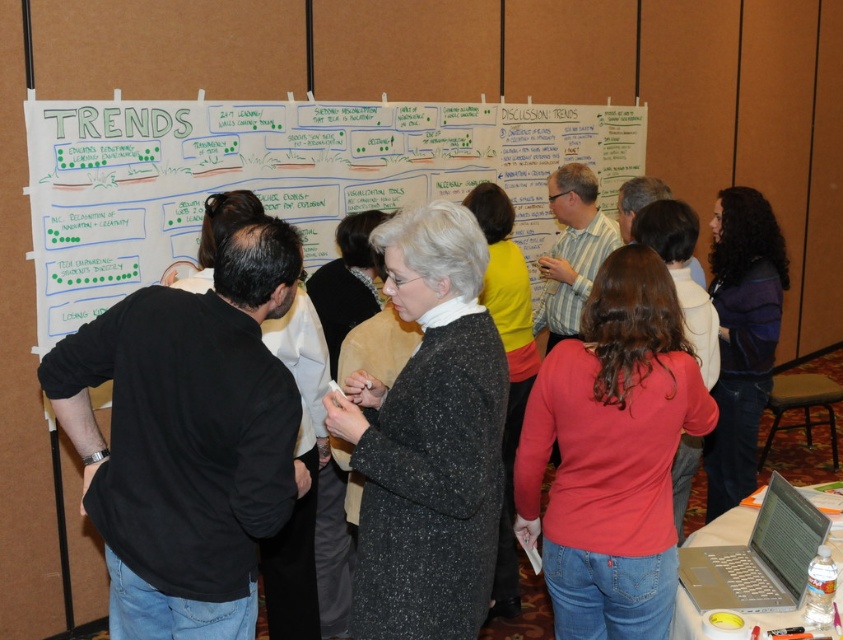
Question: Observing the image, what is the correct spatial positioning of white paperboard at center in reference to silver metallic laptop at lower right?

Choices:
 (A) right
 (B) left

Answer: (B)

Question: Which point is closer to the camera?

Choices:
 (A) (379, 573)
 (B) (720, 417)

Answer: (A)

Question: Which point appears closest to the camera in this image?

Choices:
 (A) (448, 387)
 (B) (98, 518)

Answer: (A)

Question: Which point appears closest to the camera in this image?

Choices:
 (A) (680, 330)
 (B) (747, 548)
 (C) (105, 490)

Answer: (C)

Question: Is matte red sweater at center closer to the viewer compared to silver metallic laptop at lower right?

Choices:
 (A) yes
 (B) no

Answer: (B)

Question: Does black shirt at left lie behind matte red sweater at center?

Choices:
 (A) yes
 (B) no

Answer: (B)